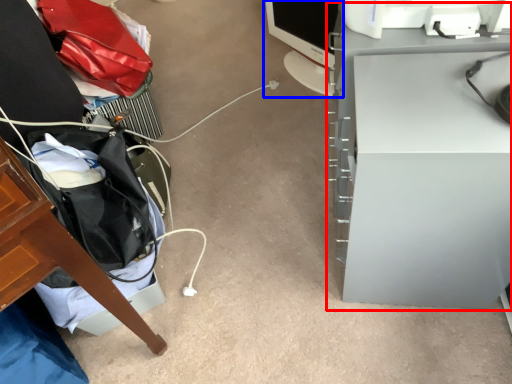
Question: Which point is further to the camera, computer desk (highlighted by a red box) or computer monitor (highlighted by a blue box)?

Choices:
 (A) computer desk
 (B) computer monitor

Answer: (B)